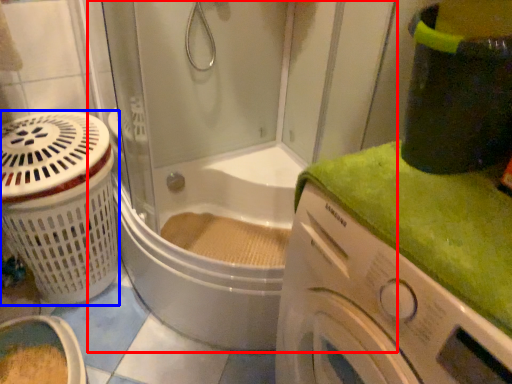
Question: Which point is further to the camera, shower door (highlighted by a red box) or basket (highlighted by a blue box)?

Choices:
 (A) shower door
 (B) basket

Answer: (B)